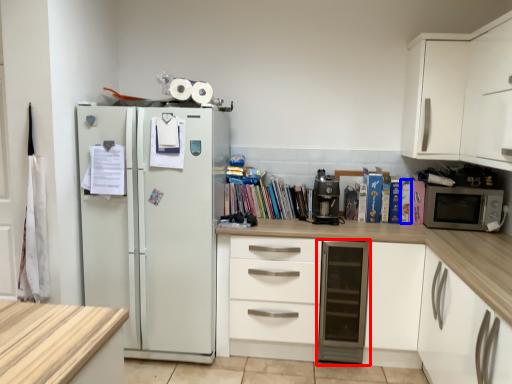
Question: Which object is closer to the camera taking this photo, dish washer (highlighted by a red box) or paperback book (highlighted by a blue box)?

Choices:
 (A) dish washer
 (B) paperback book

Answer: (A)